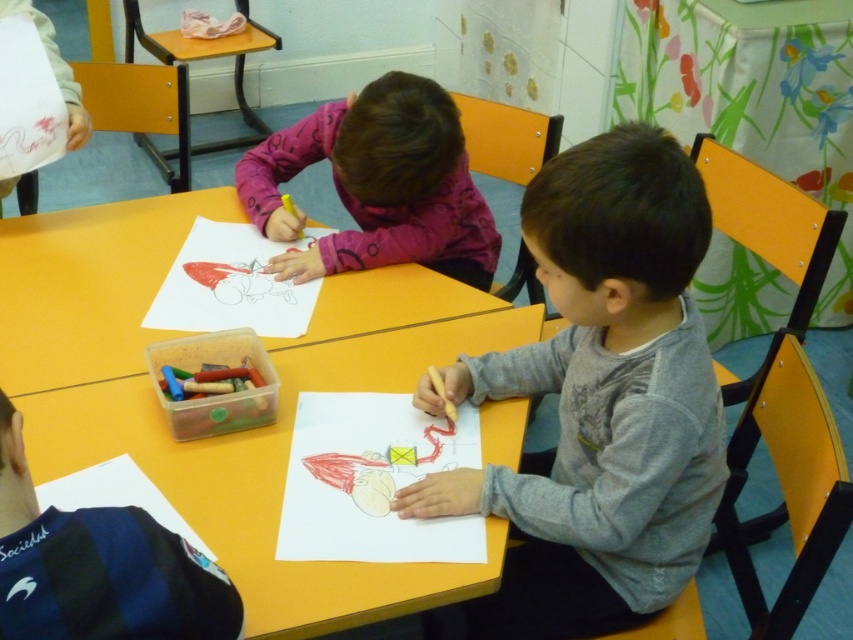
Question: Is pink matte shirt at upper center thinner than wooden crayon at center?

Choices:
 (A) yes
 (B) no

Answer: (B)

Question: Is gray cotton shirt at center further to camera compared to smooth paper at center?

Choices:
 (A) yes
 (B) no

Answer: (B)

Question: Estimate the real-world distances between objects in this image. Which object is farther from the pink matte shirt at upper center?

Choices:
 (A) colored paper at center
 (B) smooth paper at center
 (C) wooden crayon at center
 (D) yellow matte table at center

Answer: (C)

Question: Does gray cotton shirt at center come behind yellow matte table at center?

Choices:
 (A) yes
 (B) no

Answer: (B)

Question: Which point appears farthest from the camera in this image?

Choices:
 (A) (318, 604)
 (B) (387, 451)

Answer: (B)

Question: Which of the following is the farthest from the observer?

Choices:
 (A) (434, 368)
 (B) (352, 275)

Answer: (B)